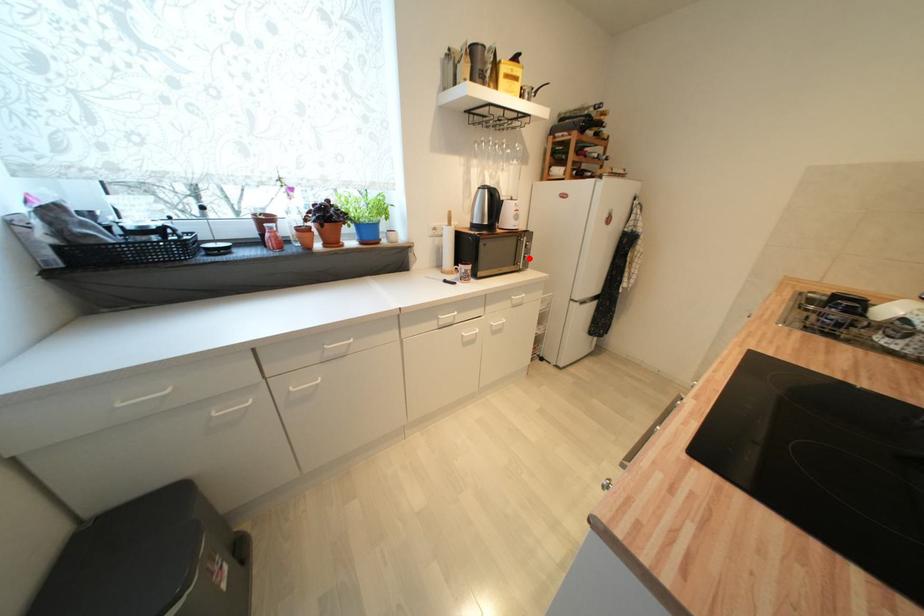
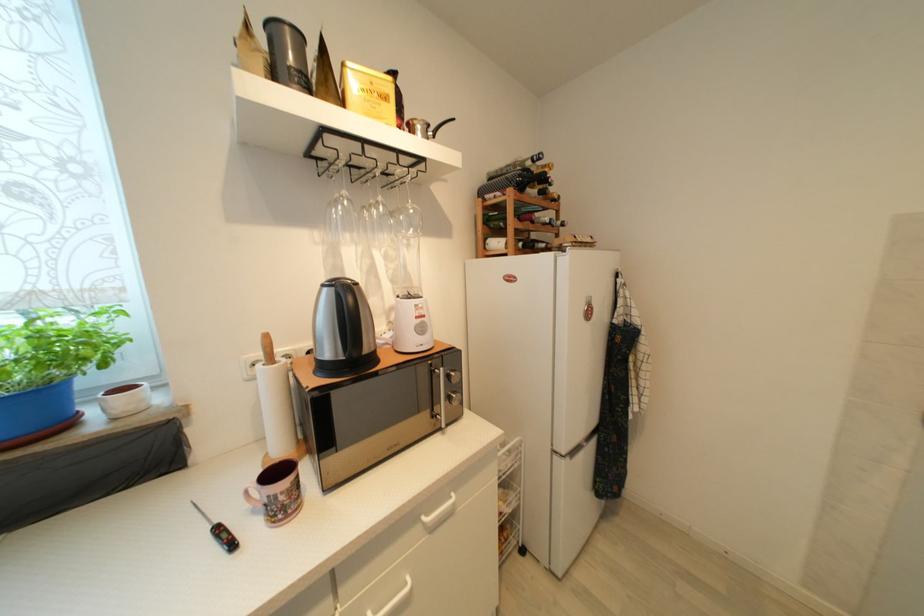
Find the pixel in the second image that matches the highlighted location in the first image.

(455, 400)